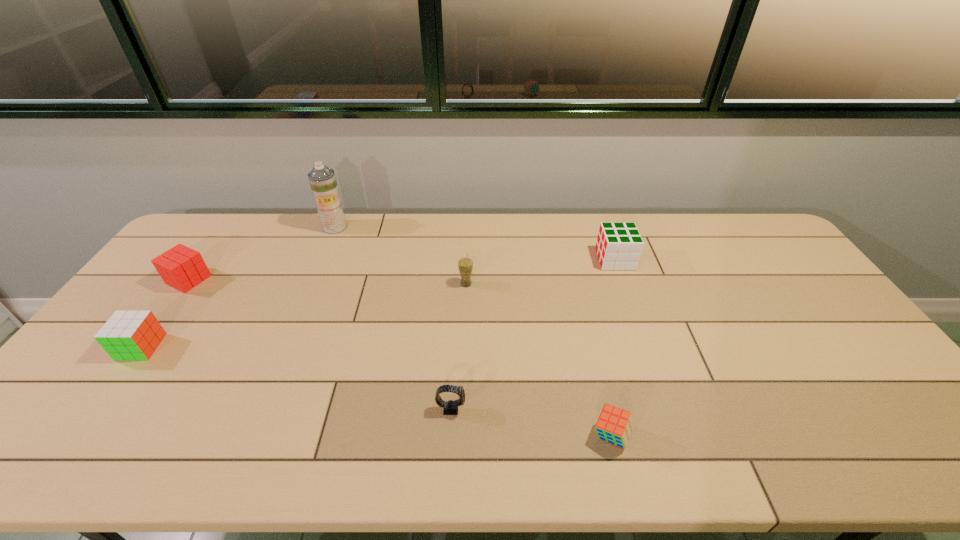
Locate an element on the screen. This screenshot has width=960, height=540. vacant area between the straw for drinking and the watch is located at coordinates (459, 346).

Image resolution: width=960 pixels, height=540 pixels. I want to click on vacant space in between the second nearest object and the third cube from left to right, so click(531, 422).

I want to click on the closest object relative to the rightmost object, so click(x=465, y=265).

The height and width of the screenshot is (540, 960). In order to click on object identified as the fifth closest to the rightmost object in this screenshot , I will do `click(180, 267)`.

The image size is (960, 540). Identify the location of the third closest cube to the nearest object. (180, 267).

Find the location of a particular element. This screenshot has width=960, height=540. the third closest cube relative to the second nearest cube is located at coordinates (619, 245).

The image size is (960, 540). I want to click on free space that satisfies the following two spatial constraints: 1. on the face of the nearest cube; 2. on the right side of the watch, so click(x=449, y=435).

Find the location of a particular element. free region that satisfies the following two spatial constraints: 1. on the face of the second nearest object; 2. on the back side of the nearest object is located at coordinates (449, 435).

At what (x,y) coordinates should I click in order to perform the action: click on free spot that satisfies the following two spatial constraints: 1. on the face of the nearest cube; 2. on the left side of the sixth farthest object. Please return your answer as a coordinate pair (x, y). This screenshot has height=540, width=960. Looking at the image, I should click on (449, 435).